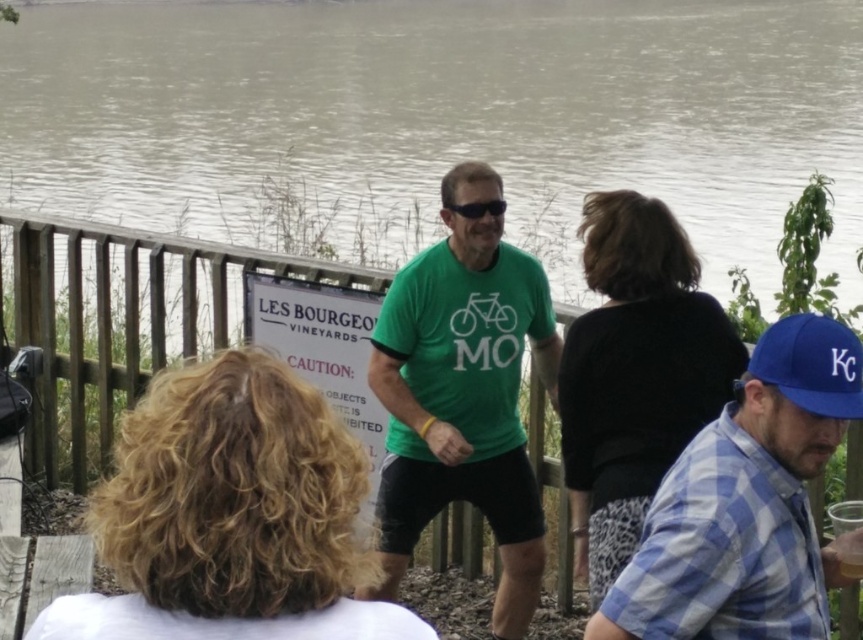
Measure the distance from grayish-brown water at upper center to blue plaid shirt at lower right.

A distance of 10.28 meters exists between grayish-brown water at upper center and blue plaid shirt at lower right.

Does grayish-brown water at upper center lie in front of blue plaid shirt at lower right?

No.

Is point (126, 26) farther from viewer compared to point (813, 627)?

That is True.

You are a GUI agent. You are given a task and a screenshot of the screen. Output one action in this format:
    pyautogui.click(x=<x>, y=<y>)
    Task: Click on the grayish-brown water at upper center
    This screenshot has width=863, height=640.
    Given the screenshot: What is the action you would take?
    pyautogui.click(x=444, y=113)

Can you confirm if blue fabric baseball cap at right is shorter than black plastic sunglasses at center?

No.

Between blue fabric baseball cap at right and black plastic sunglasses at center, which one has less height?

Standing shorter between the two is black plastic sunglasses at center.

This screenshot has height=640, width=863. I want to click on blue fabric baseball cap at right, so click(x=811, y=364).

Identify the location of blue fabric baseball cap at right. (811, 364).

Does grayish-brown water at upper center come in front of black plastic sunglasses at center?

That is False.

Between grayish-brown water at upper center and black plastic sunglasses at center, which one is positioned higher?

grayish-brown water at upper center is higher up.

Between point (742, 154) and point (443, 204), which one is positioned behind?

The point (742, 154) is behind.

In order to click on grayish-brown water at upper center in this screenshot , I will do `click(444, 113)`.